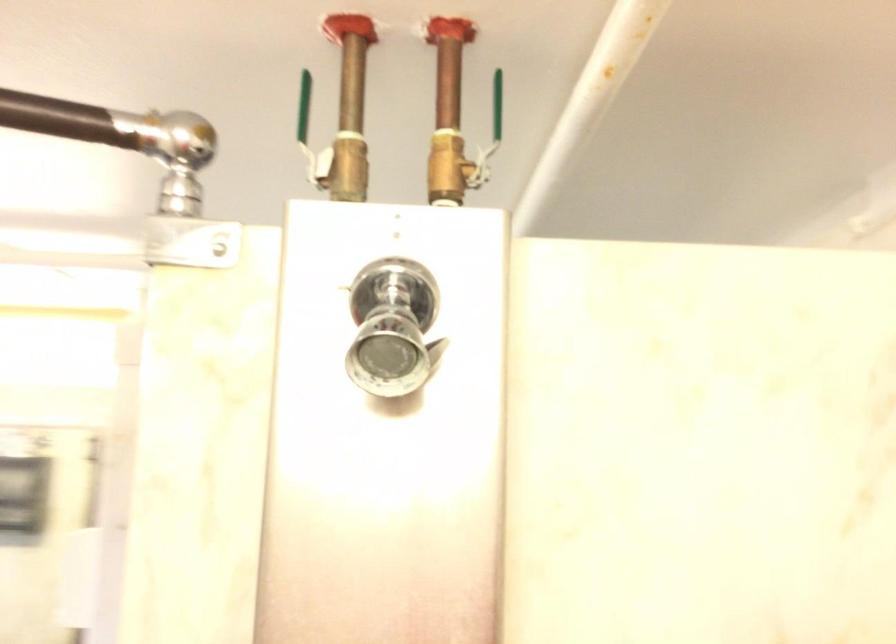
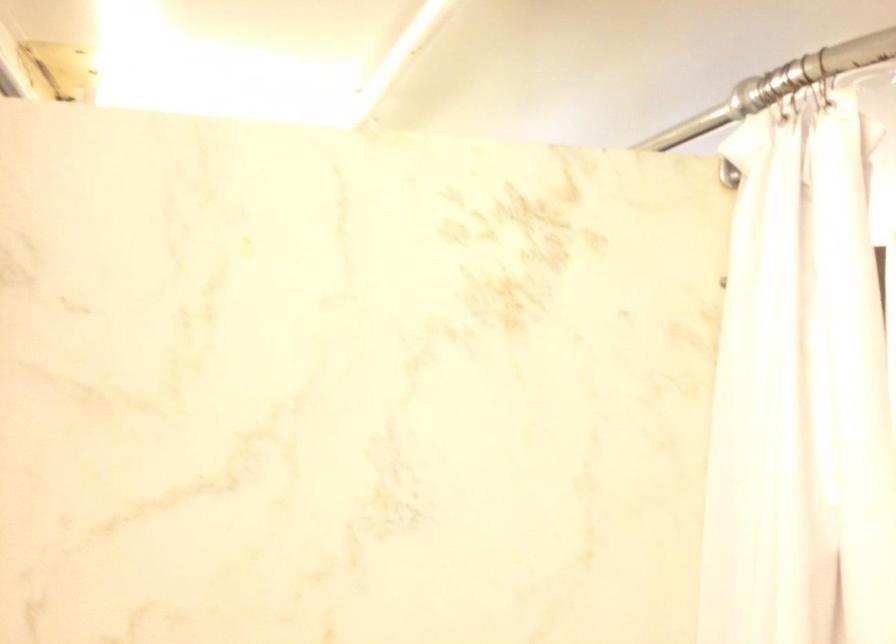
Question: How did the camera likely rotate?

Choices:
 (A) Left
 (B) Right
 (C) Up
 (D) Down

Answer: (A)